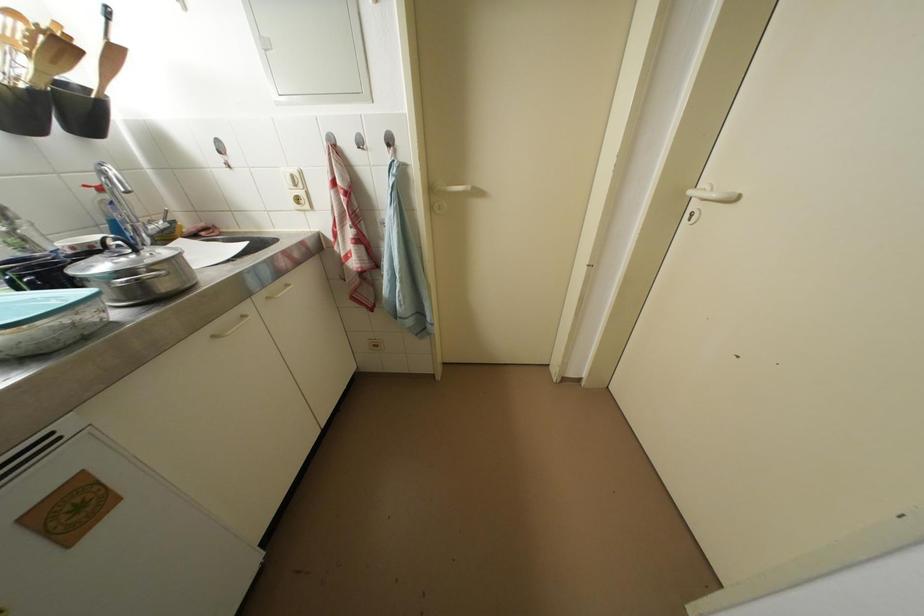
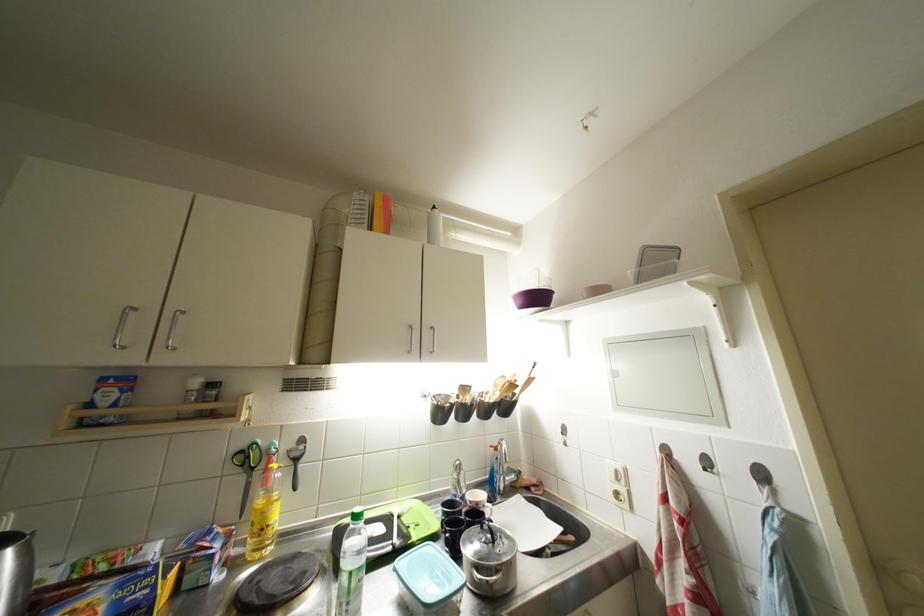
Locate, in the second image, the point that corresponds to point (142, 254) in the first image.

(500, 546)